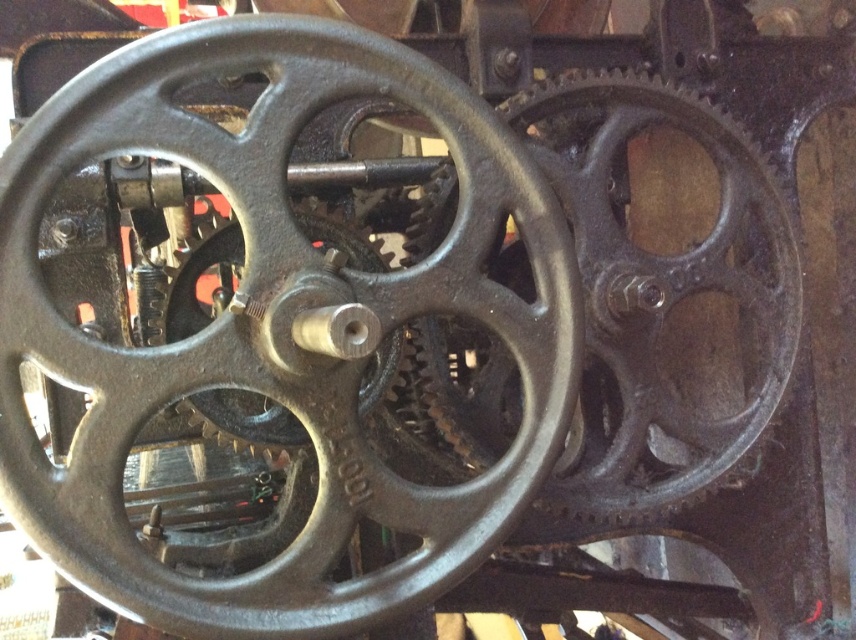
Question: Can you confirm if black cast iron wheel at center is positioned above matte black gear at center?

Choices:
 (A) no
 (B) yes

Answer: (A)

Question: Is black cast iron wheel at center positioned at the back of matte black gear at center?

Choices:
 (A) no
 (B) yes

Answer: (A)

Question: Is black cast iron wheel at center to the left of matte black gear at center from the viewer's perspective?

Choices:
 (A) no
 (B) yes

Answer: (B)

Question: Which object is closer to the camera taking this photo?

Choices:
 (A) matte black gear at center
 (B) black cast iron wheel at center

Answer: (B)